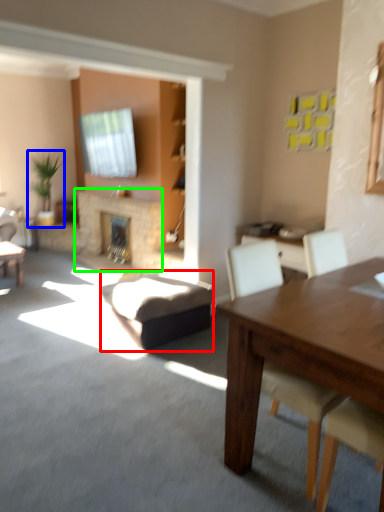
Question: Based on their relative distances, which object is nearer to swivel chair (highlighted by a red box)? Choose from houseplant (highlighted by a blue box) and fireplace (highlighted by a green box).

Choices:
 (A) houseplant
 (B) fireplace

Answer: (B)